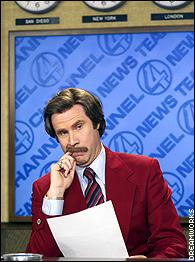
Where is `right clock`? right clock is located at coordinates (171, 5).